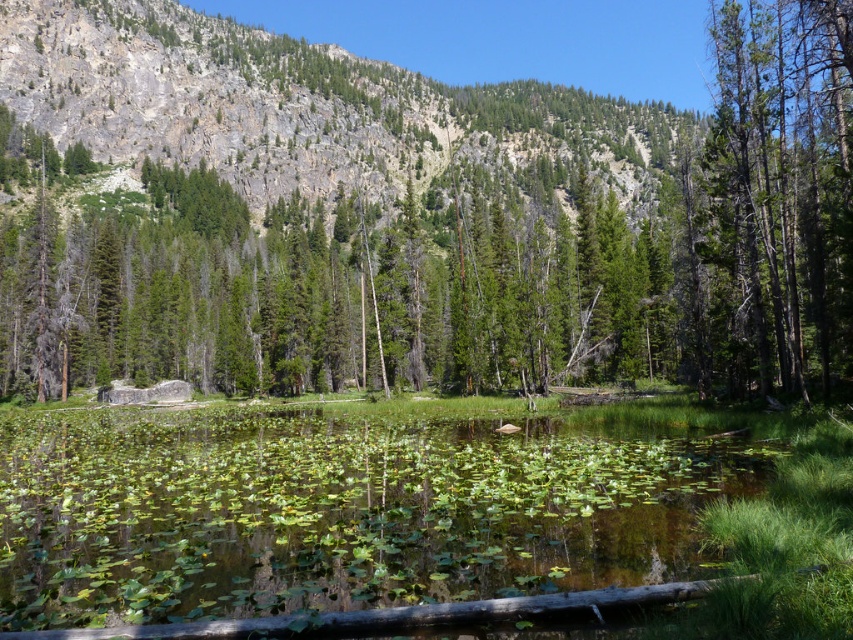
Question: Considering the relative positions of green textured hillside at upper center and green matte tree at right in the image provided, where is green textured hillside at upper center located with respect to green matte tree at right?

Choices:
 (A) above
 (B) below

Answer: (A)

Question: Which object appears farthest from the camera in this image?

Choices:
 (A) green leafy water at center
 (B) green matte tree at right

Answer: (B)

Question: Considering the real-world distances, which object is farthest from the green textured hillside at upper center?

Choices:
 (A) green matte tree at right
 (B) green leafy water at center

Answer: (A)

Question: Can you confirm if green leafy water at center is positioned to the right of green textured hillside at upper center?

Choices:
 (A) yes
 (B) no

Answer: (B)

Question: Does green leafy water at center appear on the right side of green matte tree at right?

Choices:
 (A) no
 (B) yes

Answer: (A)

Question: Among these objects, which one is nearest to the camera?

Choices:
 (A) green matte tree at right
 (B) green textured hillside at upper center

Answer: (A)